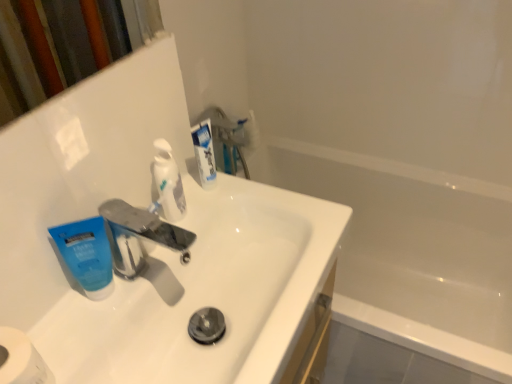
Question: From a real-world perspective, is metallic silver faucet at center located higher than white matte toilet paper at lower left?

Choices:
 (A) no
 (B) yes

Answer: (B)

Question: Is metallic silver faucet at center facing towards white matte toilet paper at lower left?

Choices:
 (A) no
 (B) yes

Answer: (A)

Question: Can you confirm if metallic silver faucet at center is positioned to the right of white matte toilet paper at lower left?

Choices:
 (A) no
 (B) yes

Answer: (B)

Question: Considering the relative sizes of metallic silver faucet at center and white matte toilet paper at lower left in the image provided, is metallic silver faucet at center taller than white matte toilet paper at lower left?

Choices:
 (A) yes
 (B) no

Answer: (B)

Question: Is metallic silver faucet at center not close to white matte toilet paper at lower left?

Choices:
 (A) yes
 (B) no

Answer: (B)

Question: Considering their positions, is white matte toilet paper at lower left located in front of or behind white glossy toothpaste at upper center, placed as the 1th toothpaste when sorted from right to left?

Choices:
 (A) front
 (B) behind

Answer: (A)

Question: Is white matte toilet paper at lower left wider or thinner than white glossy toothpaste at upper center, placed as the 1th toothpaste when sorted from right to left?

Choices:
 (A) thin
 (B) wide

Answer: (B)

Question: Choose the correct answer: Is white matte toilet paper at lower left inside white glossy toothpaste at upper center, which ranks as the 3th toothpaste in left-to-right order, or outside it?

Choices:
 (A) outside
 (B) inside

Answer: (A)

Question: In terms of size, does white matte toilet paper at lower left appear bigger or smaller than white glossy toothpaste at upper center, placed as the 1th toothpaste when sorted from right to left?

Choices:
 (A) small
 (B) big

Answer: (B)

Question: From a real-world perspective, is white glossy toothpaste at upper center, placed as the 1th toothpaste when sorted from right to left, positioned above or below white glossy toothpaste at center, which ranks as the second toothpaste in right-to-left order?

Choices:
 (A) below
 (B) above

Answer: (A)

Question: Based on their positions, is white glossy toothpaste at upper center, which ranks as the 3th toothpaste in left-to-right order, located to the left or right of white glossy toothpaste at center, which ranks as the second toothpaste in left-to-right order?

Choices:
 (A) right
 (B) left

Answer: (A)

Question: Considering the positions of white glossy toothpaste at upper center, placed as the 1th toothpaste when sorted from right to left, and white glossy toothpaste at center, which ranks as the second toothpaste in left-to-right order, in the image, is white glossy toothpaste at upper center, placed as the 1th toothpaste when sorted from right to left, bigger or smaller than white glossy toothpaste at center, which ranks as the second toothpaste in left-to-right order,?

Choices:
 (A) small
 (B) big

Answer: (A)

Question: Considering the positions of point (197, 155) and point (161, 158), is point (197, 155) closer or farther from the camera than point (161, 158)?

Choices:
 (A) farther
 (B) closer

Answer: (A)

Question: From a real-world perspective, is white glossy bathtub at center physically located above or below white glossy toothpaste at upper center, placed as the 1th toothpaste when sorted from right to left?

Choices:
 (A) above
 (B) below

Answer: (B)

Question: Looking at their shapes, would you say white glossy bathtub at center is wider or thinner than white glossy toothpaste at upper center, which ranks as the 3th toothpaste in left-to-right order?

Choices:
 (A) wide
 (B) thin

Answer: (A)